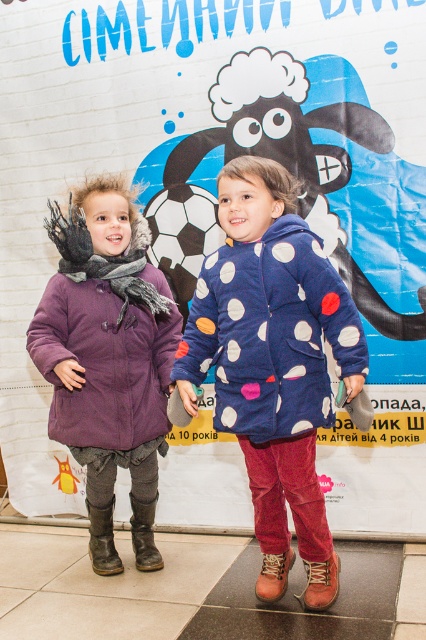
You are standing in front of the backdrop with the two children. You want to place a small sticker exactly halfway between the two points, point (x=298, y=598) and point (x=152, y=544). Considering their positions, will the sticker be closer to the backdrop or the children?

The sticker placed halfway between point (x=298, y=598) and point (x=152, y=544) will be closer to the backdrop because point (x=298, y=598) is closer to the viewer than point (x=152, y=544), so the midpoint leans towards the backdrop side.

You are a photographer setting up a tripod in the room where the scene is captured. The tripod has a fixed height and can only be placed at coordinates between 0.7 and 0.9 on the x and y axes. Is the brown leather boot at lower left within the tripod placement area?

The brown leather boot at lower left is located at point (103,540). Since the tripod requires coordinates between 0.7 and 0.9 on both axes, the x coordinate 0.845 falls within the range, but the y coordinate 0.242 is below the minimum of 0.7. Therefore, the brown leather boot at lower left is outside the tripod placement area.